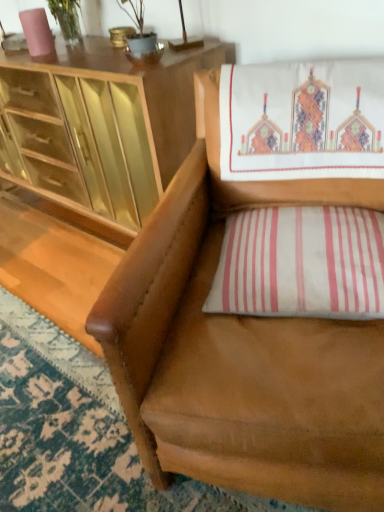
The width and height of the screenshot is (384, 512). What do you see at coordinates (240, 350) in the screenshot?
I see `brown leather chair at center` at bounding box center [240, 350].

I want to click on brown leather chair at center, so click(240, 350).

This screenshot has height=512, width=384. Identify the location of matte wood cabinet at upper left. (100, 128).

Identify the location of brown leather chair at center. (240, 350).

Image resolution: width=384 pixels, height=512 pixels. I want to click on pillow that is below the matte wood cabinet at upper left (from the image's perspective), so click(301, 264).

In the scene shown: From a real-world perspective, is white striped pillow at lower right physically below matte wood cabinet at upper left?

No, from a real-world perspective, white striped pillow at lower right is not below matte wood cabinet at upper left.

In the scene shown: Does white striped pillow at lower right touch matte wood cabinet at upper left?

They are not placed beside each other.

Relative to matte wood cabinet at upper left, is white striped pillow at lower right in front or behind?

white striped pillow at lower right is positioned closer to the viewer than matte wood cabinet at upper left.

What's the angular difference between matte wood cabinet at upper left and brown leather chair at center's facing directions?

→ The angle between the facing direction of matte wood cabinet at upper left and the facing direction of brown leather chair at center is 25.8 degrees.

Does matte wood cabinet at upper left have a larger size compared to brown leather chair at center?

Correct, matte wood cabinet at upper left is larger in size than brown leather chair at center.

Based on the photo, considering the relative positions of matte wood cabinet at upper left and brown leather chair at center in the image provided, is matte wood cabinet at upper left to the left or to the right of brown leather chair at center?

A: Based on their positions, matte wood cabinet at upper left is located to the left of brown leather chair at center.

Does point (78, 184) come farther from viewer compared to point (301, 456)?

Yes, it is behind point (301, 456).

Is brown leather chair at center looking in the opposite direction of white striped pillow at lower right?

Yes, brown leather chair at center is positioned with its back facing white striped pillow at lower right.

Is the surface of brown leather chair at center in direct contact with white striped pillow at lower right?

No, brown leather chair at center is not making contact with white striped pillow at lower right.

From the image's perspective, which one is positioned higher, brown leather chair at center or white striped pillow at lower right?

From the image's view, white striped pillow at lower right is above.

Is brown leather chair at center to the left of white striped pillow at lower right from the viewer's perspective?

Correct, you'll find brown leather chair at center to the left of white striped pillow at lower right.

Is white striped pillow at lower right not within brown leather chair at center?

No.

Is white striped pillow at lower right to the left of brown leather chair at center from the viewer's perspective?

Incorrect, white striped pillow at lower right is not on the left side of brown leather chair at center.

From the image's perspective, which one is positioned higher, white striped pillow at lower right or brown leather chair at center?

white striped pillow at lower right is shown above in the image.

Considering the positions of points (255, 253) and (335, 184), is point (255, 253) closer to camera compared to point (335, 184)?

Yes.

At what (x,y) coordinates should I click in order to perform the action: click on chair in front of the matte wood cabinet at upper left. Please return your answer as a coordinate pair (x, y). Looking at the image, I should click on (240, 350).

Based on their positions, is brown leather chair at center located to the left or right of matte wood cabinet at upper left?

brown leather chair at center is to the right of matte wood cabinet at upper left.

Does brown leather chair at center have a greater height compared to matte wood cabinet at upper left?

Indeed, brown leather chair at center has a greater height compared to matte wood cabinet at upper left.

Is brown leather chair at center located outside matte wood cabinet at upper left?

Indeed, brown leather chair at center is completely outside matte wood cabinet at upper left.

Which of these two, matte wood cabinet at upper left or white striped pillow at lower right, is bigger?

matte wood cabinet at upper left is bigger.

How much distance is there between matte wood cabinet at upper left and white striped pillow at lower right?

30.15 inches.

Does matte wood cabinet at upper left appear on the left side of white striped pillow at lower right?

Yes, matte wood cabinet at upper left is to the left of white striped pillow at lower right.

Considering their positions, is matte wood cabinet at upper left located in front of or behind white striped pillow at lower right?

Clearly, matte wood cabinet at upper left is behind white striped pillow at lower right.

Find the location of `pillow positioned vertically above the matte wood cabinet at upper left (from a real-world perspective)`. pillow positioned vertically above the matte wood cabinet at upper left (from a real-world perspective) is located at coordinates (301, 264).

This screenshot has height=512, width=384. I want to click on chair located in front of the matte wood cabinet at upper left, so click(240, 350).

Considering their positions, is white striped pillow at lower right positioned further to brown leather chair at center than matte wood cabinet at upper left?

matte wood cabinet at upper left lies further to brown leather chair at center than the other object.

Which object lies nearer to the anchor point matte wood cabinet at upper left, white striped pillow at lower right or brown leather chair at center?

brown leather chair at center is closer to matte wood cabinet at upper left.

When comparing their distances from brown leather chair at center, does matte wood cabinet at upper left or white striped pillow at lower right seem closer?

Among the two, white striped pillow at lower right is located nearer to brown leather chair at center.

When comparing their distances from white striped pillow at lower right, does brown leather chair at center or matte wood cabinet at upper left seem further?

Among the two, matte wood cabinet at upper left is located further to white striped pillow at lower right.

Estimate the real-world distances between objects in this image. Which object is further from white striped pillow at lower right, matte wood cabinet at upper left or brown leather chair at center?

matte wood cabinet at upper left is positioned further to the anchor white striped pillow at lower right.

When comparing their distances from matte wood cabinet at upper left, does brown leather chair at center or white striped pillow at lower right seem closer?

Among the two, brown leather chair at center is located nearer to matte wood cabinet at upper left.

The image size is (384, 512). I want to click on chair between matte wood cabinet at upper left and white striped pillow at lower right from left to right, so click(240, 350).